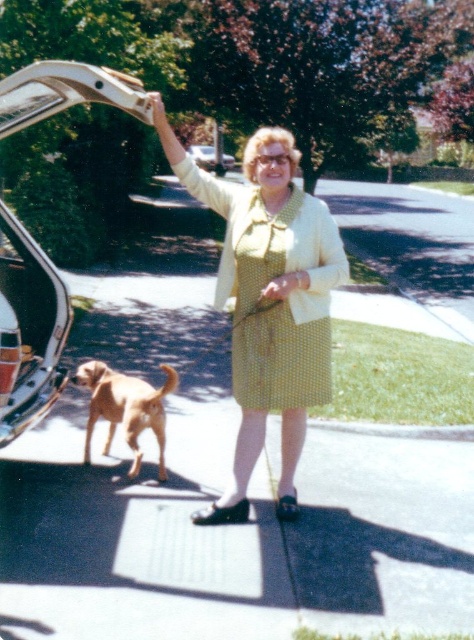
You are a delivery person standing in front of the metallic silver car at left. You need to reach the trunk to deliver a package. Considering your height is 1.75 meters, will you be able to see the trunk from your current position?

The metallic silver car at left is 3.80 meters away from you. Since the distance is greater than your height of 1.75 meters, you can see the trunk as long as there are no obstructions. The scene describes an open trunk with a woman and a dog nearby, so there is a clear line of sight.

You are a photographer planning to take a portrait of the woman wearing the yellow dotted dress at center and the metallic silver car at center. To ensure both subjects are in focus, you need to know their heights. Which one is taller?

The metallic silver car at center is taller than the yellow dotted dress at center.